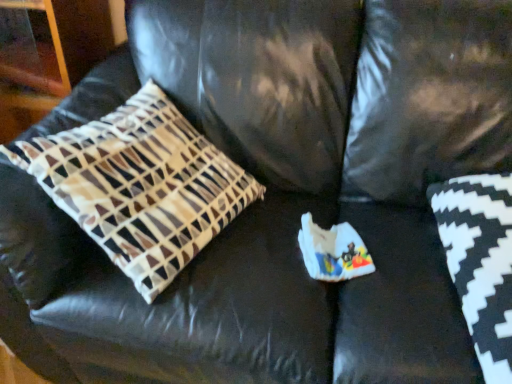
Question: In the image, is black and white zigzag pillow at lower right, which is the 2th pillow in left-to-right order, positioned in front of or behind patterned fabric pillow at left, which appears as the 1th pillow when viewed from the left?

Choices:
 (A) behind
 (B) front

Answer: (A)

Question: Looking at the image, does black and white zigzag pillow at lower right, which ranks as the 1th pillow in right-to-left order, seem bigger or smaller compared to patterned fabric pillow at left, which appears as the 1th pillow when viewed from the left?

Choices:
 (A) small
 (B) big

Answer: (A)

Question: Is point (472, 286) positioned closer to the camera than point (174, 117)?

Choices:
 (A) closer
 (B) farther

Answer: (A)

Question: Which is correct: patterned fabric pillow at left, marked as the second pillow in a right-to-left arrangement, is inside black and white zigzag pillow at lower right, which is the 2th pillow in left-to-right order, or outside of it?

Choices:
 (A) outside
 (B) inside

Answer: (A)

Question: From a real-world perspective, is patterned fabric pillow at left, marked as the second pillow in a right-to-left arrangement, above or below black and white zigzag pillow at lower right, which is the 2th pillow in left-to-right order?

Choices:
 (A) above
 (B) below

Answer: (A)

Question: From the image's perspective, is patterned fabric pillow at left, marked as the second pillow in a right-to-left arrangement, located above or below black and white zigzag pillow at lower right, which ranks as the 1th pillow in right-to-left order?

Choices:
 (A) below
 (B) above

Answer: (B)

Question: Considering the positions of point (69, 134) and point (500, 326), is point (69, 134) closer or farther from the camera than point (500, 326)?

Choices:
 (A) closer
 (B) farther

Answer: (B)